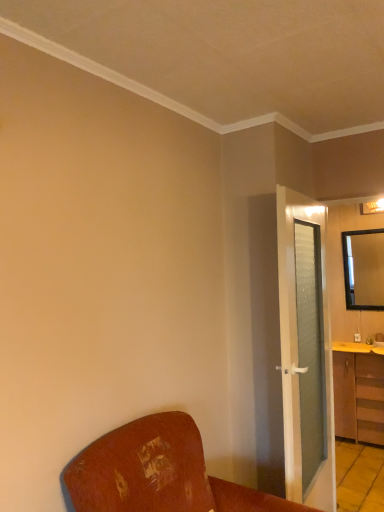
In order to face wooden cabinet at right, should I rotate leftwards or rightwards?

Rotate your view right by about 21.522°.

Identify the location of green frosted glass door at right. This screenshot has width=384, height=512. pyautogui.click(x=296, y=351).

What do you see at coordinates (157, 473) in the screenshot? The height and width of the screenshot is (512, 384). I see `wooden chair at lower left` at bounding box center [157, 473].

Measure the distance between wooden chair at lower left and camera.

4.50 feet.

You are a GUI agent. You are given a task and a screenshot of the screen. Output one action in this format:
    pyautogui.click(x=<x>, y=<y>)
    Task: Click on the black framed mirror at upper right
    
    Given the screenshot: What is the action you would take?
    pyautogui.click(x=364, y=269)

Is wooden cabinet at right placed right next to green frosted glass door at right?

wooden cabinet at right is not next to green frosted glass door at right, and they're not touching.

Is wooden cabinet at right wider or thinner than green frosted glass door at right?

wooden cabinet at right is wider than green frosted glass door at right.

Is green frosted glass door at right surrounded by wooden cabinet at right?

No, green frosted glass door at right is not a part of wooden cabinet at right.

Is wooden cabinet at right facing away from green frosted glass door at right?

That's not correct — wooden cabinet at right is not looking away from green frosted glass door at right.

Based on the photo, can you confirm if wooden cabinet at right is shorter than yellow wood counter top at right?

Incorrect, the height of wooden cabinet at right does not fall short of that of yellow wood counter top at right.

Which is more distant, (334, 344) or (368, 351)?

Positioned behind is point (334, 344).

In the scene shown: From the image's perspective, which is below, wooden cabinet at right or yellow wood counter top at right?

wooden cabinet at right is shown below in the image.

Is wooden cabinet at right to the right of yellow wood counter top at right from the viewer's perspective?

Yes, wooden cabinet at right is to the right of yellow wood counter top at right.

Between wooden chair at lower left and black framed mirror at upper right, which one has larger size?

wooden chair at lower left.

Which of these two, wooden chair at lower left or black framed mirror at upper right, is wider?

wooden chair at lower left.

Which of these two, wooden chair at lower left or black framed mirror at upper right, stands taller?

Standing taller between the two is black framed mirror at upper right.

Considering the relative positions of wooden chair at lower left and black framed mirror at upper right in the image provided, is wooden chair at lower left to the right of black framed mirror at upper right from the viewer's perspective?

Incorrect, wooden chair at lower left is not on the right side of black framed mirror at upper right.

Is wooden cabinet at right facing towards black framed mirror at upper right?

No.

From the image's perspective, who appears lower, wooden cabinet at right or black framed mirror at upper right?

wooden cabinet at right, from the image's perspective.

In the scene shown: Does wooden cabinet at right appear on the left side of black framed mirror at upper right?

Indeed, wooden cabinet at right is positioned on the left side of black framed mirror at upper right.

Considering the relative positions of yellow wood counter top at right and black framed mirror at upper right in the image provided, is yellow wood counter top at right to the right of black framed mirror at upper right from the viewer's perspective?

No, yellow wood counter top at right is not to the right of black framed mirror at upper right.

Considering the sizes of yellow wood counter top at right and black framed mirror at upper right in the image, is yellow wood counter top at right wider or thinner than black framed mirror at upper right?

Clearly, yellow wood counter top at right has more width compared to black framed mirror at upper right.

Is yellow wood counter top at right positioned far away from black framed mirror at upper right?

yellow wood counter top at right is actually quite close to black framed mirror at upper right.

Looking at this image, considering the sizes of objects yellow wood counter top at right and black framed mirror at upper right in the image provided, who is taller, yellow wood counter top at right or black framed mirror at upper right?

With more height is black framed mirror at upper right.

Would you say green frosted glass door at right is a long distance from black framed mirror at upper right?

Yes, green frosted glass door at right and black framed mirror at upper right are quite far apart.

Who is shorter, green frosted glass door at right or black framed mirror at upper right?

black framed mirror at upper right.

Based on the photo, which is nearer, (282, 298) or (382, 273)?

Clearly, point (282, 298) is closer to the camera than point (382, 273).

Could you tell me if green frosted glass door at right is turned towards black framed mirror at upper right?

No.

Does black framed mirror at upper right have a lesser height compared to green frosted glass door at right?

Yes.

At what (x,y) coordinates should I click in order to perform the action: click on mirror above the green frosted glass door at right (from a real-world perspective). Please return your answer as a coordinate pair (x, y). Looking at the image, I should click on (364, 269).

Can you tell me how much black framed mirror at upper right and green frosted glass door at right differ in facing direction?

The angle between the facing direction of black framed mirror at upper right and the facing direction of green frosted glass door at right is 94.4 degrees.

Looking at this image, which is more to the right, black framed mirror at upper right or green frosted glass door at right?

Positioned to the right is black framed mirror at upper right.

Image resolution: width=384 pixels, height=512 pixels. I want to click on cabinetry that appears below the green frosted glass door at right (from a real-world perspective), so click(x=358, y=392).

You are a GUI agent. You are given a task and a screenshot of the screen. Output one action in this format:
    pyautogui.click(x=<x>, y=<y>)
    Task: Click on the counter top above the wooden cabinet at right (from a real-world perspective)
    This screenshot has width=384, height=512.
    Given the screenshot: What is the action you would take?
    [x=357, y=347]

When comparing their distances from black framed mirror at upper right, does wooden cabinet at right or yellow wood counter top at right seem closer?

yellow wood counter top at right.

Which object lies nearer to the anchor point wooden cabinet at right, black framed mirror at upper right or green frosted glass door at right?

black framed mirror at upper right is positioned closer to the anchor wooden cabinet at right.

Looking at this image, looking at the image, which one is located further to black framed mirror at upper right, green frosted glass door at right or wooden cabinet at right?

The object further to black framed mirror at upper right is green frosted glass door at right.

When comparing their distances from yellow wood counter top at right, does black framed mirror at upper right or green frosted glass door at right seem closer?

black framed mirror at upper right is closer to yellow wood counter top at right.

Looking at the image, which one is located closer to wooden chair at lower left, black framed mirror at upper right or green frosted glass door at right?

green frosted glass door at right is positioned closer to the anchor wooden chair at lower left.

Looking at this image, which object lies nearer to the anchor point black framed mirror at upper right, wooden chair at lower left or yellow wood counter top at right?

Based on the image, yellow wood counter top at right appears to be nearer to black framed mirror at upper right.

Which object lies nearer to the anchor point yellow wood counter top at right, green frosted glass door at right or black framed mirror at upper right?

black framed mirror at upper right is positioned closer to the anchor yellow wood counter top at right.

From the picture: Looking at the image, which one is located closer to wooden cabinet at right, yellow wood counter top at right or black framed mirror at upper right?

yellow wood counter top at right.

Locate an element on the screen. The width and height of the screenshot is (384, 512). counter top between green frosted glass door at right and black framed mirror at upper right from front to back is located at coordinates (357, 347).

Where is `door between wooden chair at lower left and yellow wood counter top at right in the front-back direction`? The height and width of the screenshot is (512, 384). door between wooden chair at lower left and yellow wood counter top at right in the front-back direction is located at coordinates (296, 351).

Identify the location of cabinetry between green frosted glass door at right and black framed mirror at upper right in the front-back direction. (358, 392).

What are the coordinates of `cabinetry between wooden chair at lower left and black framed mirror at upper right in the front-back direction` in the screenshot? It's located at (358, 392).